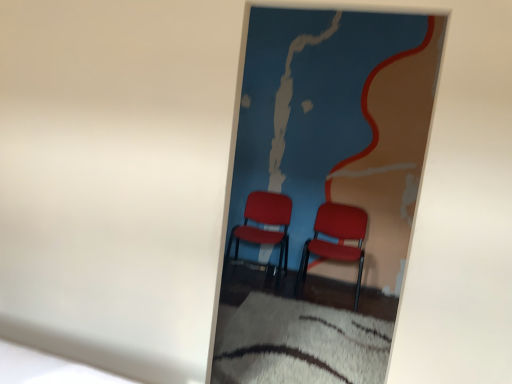
Identify the location of white shaggy rug at lower center. (300, 344).

In order to click on matte plastic chairs at center in this screenshot , I will do `click(324, 192)`.

Describe the element at coordinates (337, 238) in the screenshot. I see `matte red chair at center, arranged as the 2th chair when viewed from the left` at that location.

Identify the location of matte plastic chair at center, which ranks as the second chair in right-to-left order. The height and width of the screenshot is (384, 512). (264, 223).

Could you tell me if matte plastic chairs at center is turned towards matte red chair at center, arranged as the 2th chair when viewed from the left?

No, matte plastic chairs at center is not facing towards matte red chair at center, arranged as the 2th chair when viewed from the left.

How much distance is there between matte plastic chairs at center and matte red chair at center, marked as the 1th chair in a right-to-left arrangement?

23.42 inches.

Is matte plastic chairs at center located outside matte red chair at center, marked as the 1th chair in a right-to-left arrangement?

Answer: Yes.

Is matte plastic chair at center, which ranks as the second chair in right-to-left order, wider than matte plastic chairs at center?

Yes, matte plastic chair at center, which ranks as the second chair in right-to-left order, is wider than matte plastic chairs at center.

Is matte plastic chair at center, the 1th chair from the left, outside of matte plastic chairs at center?

matte plastic chair at center, the 1th chair from the left, is positioned outside matte plastic chairs at center.

Which is in front, point (270, 236) or point (408, 45)?

The point (408, 45) is more forward.

From the image's perspective, is white shaggy rug at lower center under matte plastic chair at center, the 1th chair from the left?

→ Yes, from the image's perspective, white shaggy rug at lower center is beneath matte plastic chair at center, the 1th chair from the left.

Looking at this image, which object is positioned more to the left, white shaggy rug at lower center or matte plastic chair at center, which ranks as the second chair in right-to-left order?

matte plastic chair at center, which ranks as the second chair in right-to-left order.

Which of these two, white shaggy rug at lower center or matte plastic chair at center, which ranks as the second chair in right-to-left order, stands taller?

Standing taller between the two is matte plastic chair at center, which ranks as the second chair in right-to-left order.

Choose the correct answer: Is white shaggy rug at lower center inside matte plastic chair at center, which ranks as the second chair in right-to-left order, or outside it?

white shaggy rug at lower center exists outside the volume of matte plastic chair at center, which ranks as the second chair in right-to-left order.

Considering the relative sizes of white shaggy rug at lower center and matte plastic chairs at center in the image provided, is white shaggy rug at lower center taller than matte plastic chairs at center?

Incorrect, the height of white shaggy rug at lower center is not larger of that of matte plastic chairs at center.

Between white shaggy rug at lower center and matte plastic chairs at center, which one has larger size?

Bigger between the two is matte plastic chairs at center.

Is white shaggy rug at lower center in front of or behind matte plastic chairs at center in the image?

white shaggy rug at lower center is behind matte plastic chairs at center.

Is matte plastic chairs at center oriented away from matte plastic chair at center, which ranks as the second chair in right-to-left order?

Yes, matte plastic chair at center, which ranks as the second chair in right-to-left order, is at the back of matte plastic chairs at center.

Is there a large distance between matte plastic chairs at center and matte plastic chair at center, the 1th chair from the left?

Actually, matte plastic chairs at center and matte plastic chair at center, the 1th chair from the left, are a little close together.

Who is smaller, matte plastic chairs at center or matte plastic chair at center, the 1th chair from the left?

matte plastic chairs at center is smaller.

Does matte red chair at center, marked as the 1th chair in a right-to-left arrangement, have a lesser width compared to matte plastic chairs at center?

Incorrect, the width of matte red chair at center, marked as the 1th chair in a right-to-left arrangement, is not less than that of matte plastic chairs at center.

Does point (357, 286) lie behind point (350, 124)?

That is True.

I want to click on picture frame lying above the matte red chair at center, marked as the 1th chair in a right-to-left arrangement (from the image's perspective), so click(x=324, y=192).

Considering the sizes of objects matte red chair at center, marked as the 1th chair in a right-to-left arrangement, and matte plastic chairs at center in the image provided, who is shorter, matte red chair at center, marked as the 1th chair in a right-to-left arrangement, or matte plastic chairs at center?

matte red chair at center, marked as the 1th chair in a right-to-left arrangement, is shorter.

Can we say matte plastic chair at center, the 1th chair from the left, lies outside matte red chair at center, arranged as the 2th chair when viewed from the left?

matte plastic chair at center, the 1th chair from the left, is positioned outside matte red chair at center, arranged as the 2th chair when viewed from the left.

Considering the sizes of objects matte plastic chair at center, which ranks as the second chair in right-to-left order, and matte red chair at center, arranged as the 2th chair when viewed from the left, in the image provided, who is shorter, matte plastic chair at center, which ranks as the second chair in right-to-left order, or matte red chair at center, arranged as the 2th chair when viewed from the left,?

matte red chair at center, arranged as the 2th chair when viewed from the left.

From a real-world perspective, is matte plastic chair at center, which ranks as the second chair in right-to-left order, positioned above or below matte red chair at center, arranged as the 2th chair when viewed from the left?

matte plastic chair at center, which ranks as the second chair in right-to-left order, is situated higher than matte red chair at center, arranged as the 2th chair when viewed from the left, in the real world.

Find the location of a particular element. the 2nd chair positioned below the matte plastic chairs at center (from the image's perspective) is located at coordinates (337, 238).

The width and height of the screenshot is (512, 384). I want to click on chair that is on the left side of matte plastic chairs at center, so pyautogui.click(x=264, y=223).

Estimate the real-world distances between objects in this image. Which object is closer to white shaggy rug at lower center, matte plastic chairs at center or matte red chair at center, arranged as the 2th chair when viewed from the left?

matte plastic chairs at center lies closer to white shaggy rug at lower center than the other object.

Based on their spatial positions, is matte red chair at center, marked as the 1th chair in a right-to-left arrangement, or matte plastic chairs at center closer to white shaggy rug at lower center?

matte plastic chairs at center is positioned closer to the anchor white shaggy rug at lower center.

Which object lies further to the anchor point matte red chair at center, arranged as the 2th chair when viewed from the left, matte plastic chairs at center or matte plastic chair at center, which ranks as the second chair in right-to-left order?

Result: The object further to matte red chair at center, arranged as the 2th chair when viewed from the left, is matte plastic chairs at center.

Considering their positions, is matte plastic chair at center, which ranks as the second chair in right-to-left order, positioned further to matte red chair at center, marked as the 1th chair in a right-to-left arrangement, than white shaggy rug at lower center?

white shaggy rug at lower center is positioned further to the anchor matte red chair at center, marked as the 1th chair in a right-to-left arrangement.

When comparing their distances from white shaggy rug at lower center, does matte plastic chairs at center or matte plastic chair at center, the 1th chair from the left, seem further?

matte plastic chair at center, the 1th chair from the left, is positioned further to the anchor white shaggy rug at lower center.

Which object lies further to the anchor point matte plastic chairs at center, matte plastic chair at center, which ranks as the second chair in right-to-left order, or matte red chair at center, arranged as the 2th chair when viewed from the left?

matte plastic chair at center, which ranks as the second chair in right-to-left order, lies further to matte plastic chairs at center than the other object.

Which object lies further to the anchor point white shaggy rug at lower center, matte red chair at center, marked as the 1th chair in a right-to-left arrangement, or matte plastic chair at center, the 1th chair from the left?

matte red chair at center, marked as the 1th chair in a right-to-left arrangement, is further to white shaggy rug at lower center.

When comparing their distances from matte red chair at center, marked as the 1th chair in a right-to-left arrangement, does white shaggy rug at lower center or matte plastic chairs at center seem further?

white shaggy rug at lower center is further to matte red chair at center, marked as the 1th chair in a right-to-left arrangement.

Locate an element on the screen. The height and width of the screenshot is (384, 512). sheet between matte plastic chairs at center and matte plastic chair at center, which ranks as the second chair in right-to-left order, in the front-back direction is located at coordinates (300, 344).

Locate an element on the screen. This screenshot has width=512, height=384. sheet between matte plastic chairs at center and matte red chair at center, arranged as the 2th chair when viewed from the left, along the z-axis is located at coordinates (300, 344).

Locate an element on the screen. This screenshot has height=384, width=512. chair between white shaggy rug at lower center and matte plastic chair at center, which ranks as the second chair in right-to-left order, from front to back is located at coordinates (337, 238).

The width and height of the screenshot is (512, 384). I want to click on chair between matte plastic chairs at center and matte plastic chair at center, which ranks as the second chair in right-to-left order, from front to back, so click(337, 238).